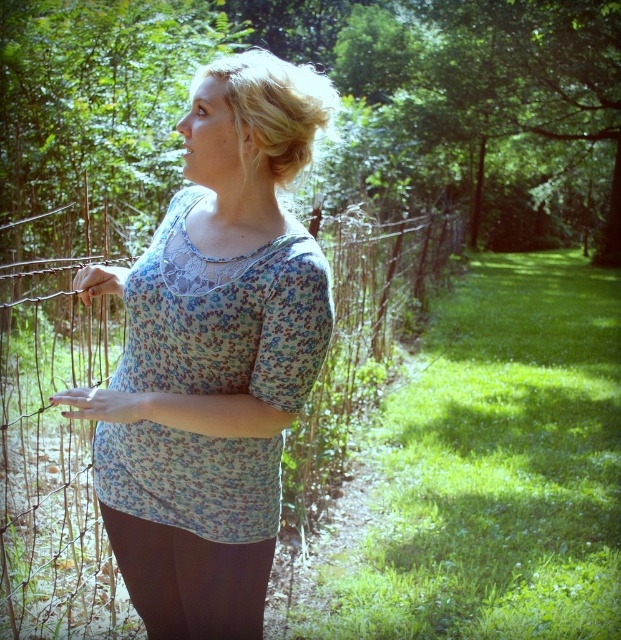
Between floral-patterned fabric shirt at center and black leggings at lower center, which one appears on the left side from the viewer's perspective?

floral-patterned fabric shirt at center

Between floral-patterned fabric shirt at center and black leggings at lower center, which one has less height?

black leggings at lower center

Identify the location of floral-patterned fabric shirt at center. (212, 356).

At what (x,y) coordinates should I click in order to perform the action: click on floral-patterned fabric shirt at center. Please return your answer as a coordinate pair (x, y). The width and height of the screenshot is (621, 640). Looking at the image, I should click on (212, 356).